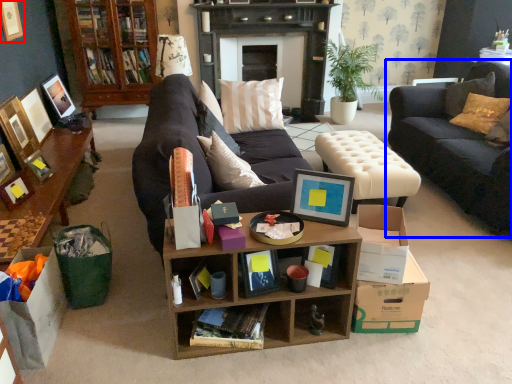
Question: Among these objects, which one is farthest to the camera, picture frame (highlighted by a red box) or studio couch (highlighted by a blue box)?

Choices:
 (A) picture frame
 (B) studio couch

Answer: (A)